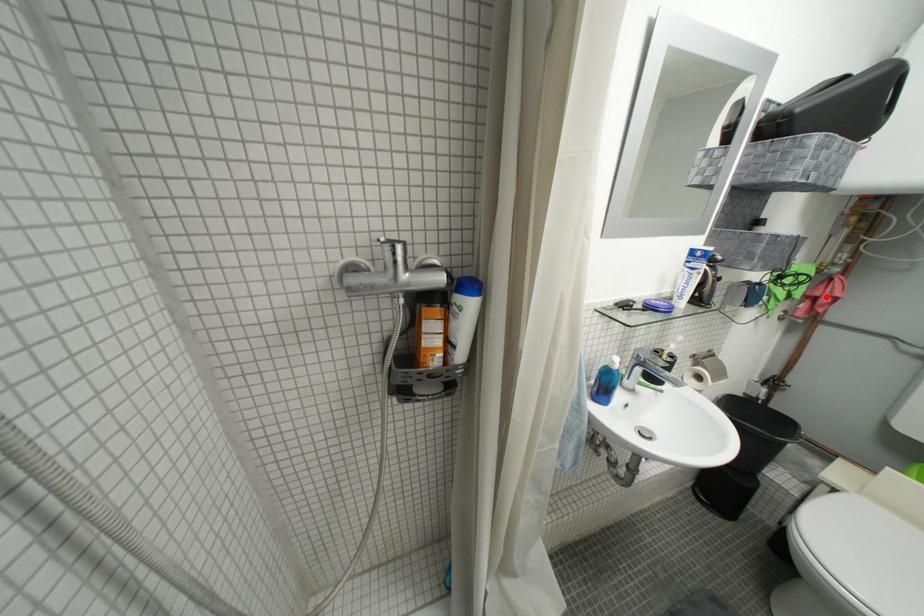
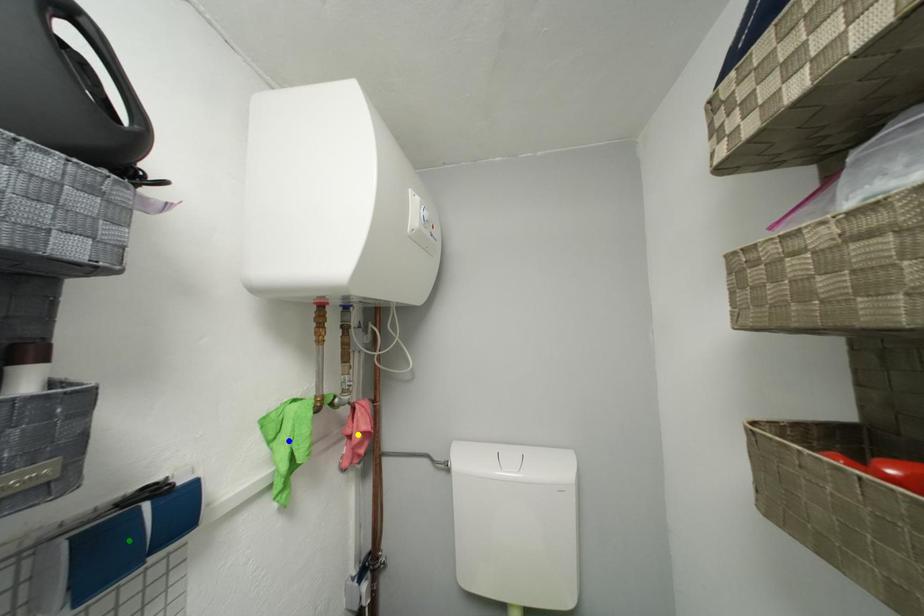
Question: I am providing you with two images of the same scene from different viewpoints. A red point is marked on the first image. You are given multiple points on the second image. Can you choose the point in image 2 that corresponds to the point in image 1?

Choices:
 (A) green point
 (B) yellow point
 (C) blue point

Answer: (B)